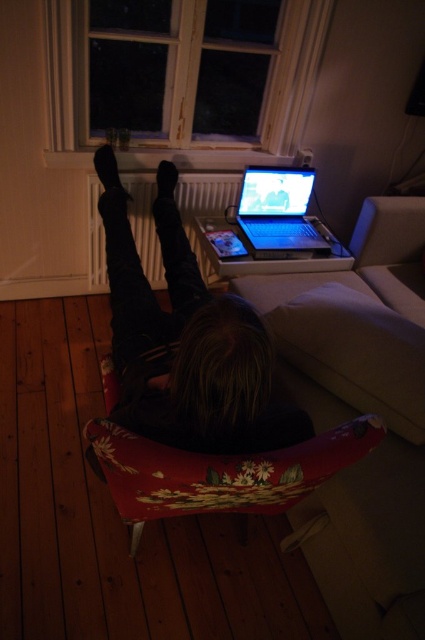
Based on the scene description, where is the white fabric couch at center located in the image?

The white fabric couch at center is located at point coordinates of [362,412].

You are standing in the room and want to place a small plant exactly at point (223,390). The plant requires a spot that is at least 3 feet away from the camera to ensure proper growth. Can you confirm if the point is suitable?

The distance of point (223,390) from camera is 3.31 feet, which meets the requirement of at least 3 feet. Therefore, the point is suitable for placing the plant.

You are arranging a living room and want to place a new lamp between the white fabric couch at center and the shiny silver laptop at center. Based on their positions, which object should the lamp be closer to?

The lamp should be placed closer to the shiny silver laptop at center because the white fabric couch at center is located to the right of the laptop, meaning the laptop is to the left of the couch. Therefore, placing the lamp between them would require it to be closer to the laptop to maintain symmetry or balance.